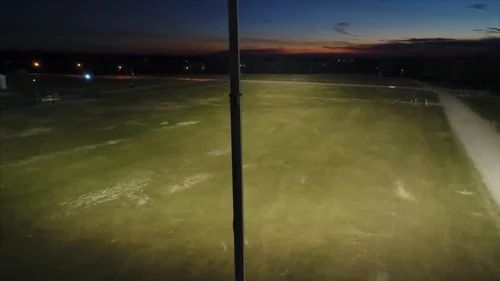
What are the coordinates of `light` in the screenshot? It's located at (84, 77), (78, 62), (35, 63), (36, 79), (121, 66), (187, 67), (204, 67), (403, 68), (338, 59).